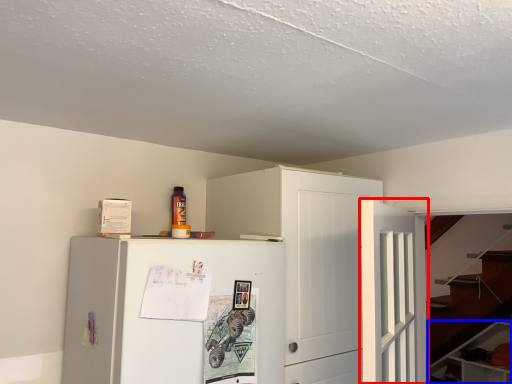
Question: Which point is further to the camera, door (highlighted by a red box) or cabinetry (highlighted by a blue box)?

Choices:
 (A) door
 (B) cabinetry

Answer: (B)